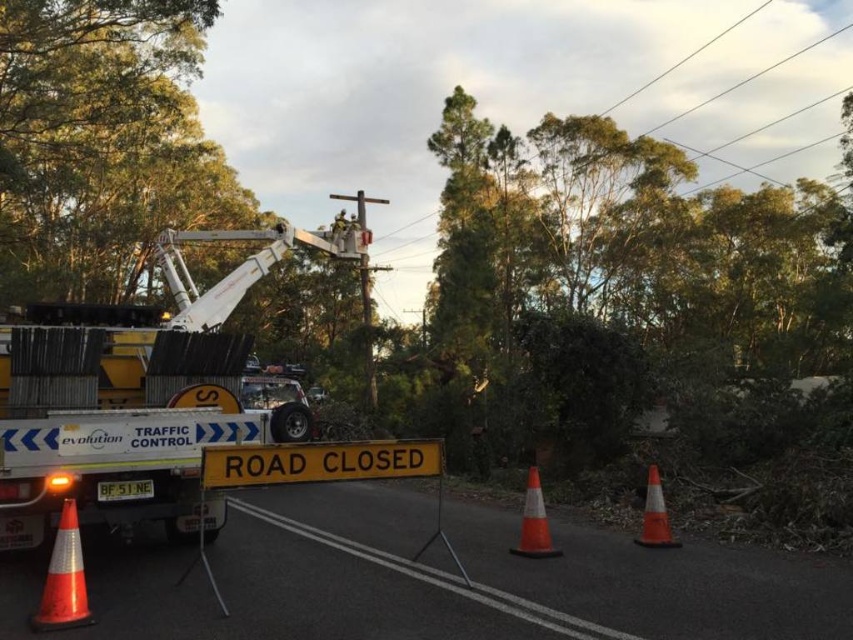
Is point (140, 449) positioned before point (525, 548)?

Yes.

Does white metallic tow truck at center have a lesser height compared to orange reflective cone at center?

In fact, white metallic tow truck at center may be taller than orange reflective cone at center.

The image size is (853, 640). Describe the element at coordinates (137, 400) in the screenshot. I see `white metallic tow truck at center` at that location.

Where is `white metallic tow truck at center`? The height and width of the screenshot is (640, 853). white metallic tow truck at center is located at coordinates (137, 400).

Is orange reflective cone at lower left wider than orange reflective cone at right?

In fact, orange reflective cone at lower left might be narrower than orange reflective cone at right.

Can you confirm if orange reflective cone at lower left is positioned to the right of orange reflective cone at right?

In fact, orange reflective cone at lower left is to the left of orange reflective cone at right.

Who is more distant from viewer, (x=90, y=616) or (x=672, y=544)?

The point (x=672, y=544) is behind.

Image resolution: width=853 pixels, height=640 pixels. What are the coordinates of `orange reflective cone at lower left` in the screenshot? It's located at (64, 577).

Identify the location of white metallic tow truck at center. (137, 400).

This screenshot has height=640, width=853. What are the coordinates of `white metallic tow truck at center` in the screenshot? It's located at (137, 400).

Image resolution: width=853 pixels, height=640 pixels. I want to click on white metallic tow truck at center, so click(137, 400).